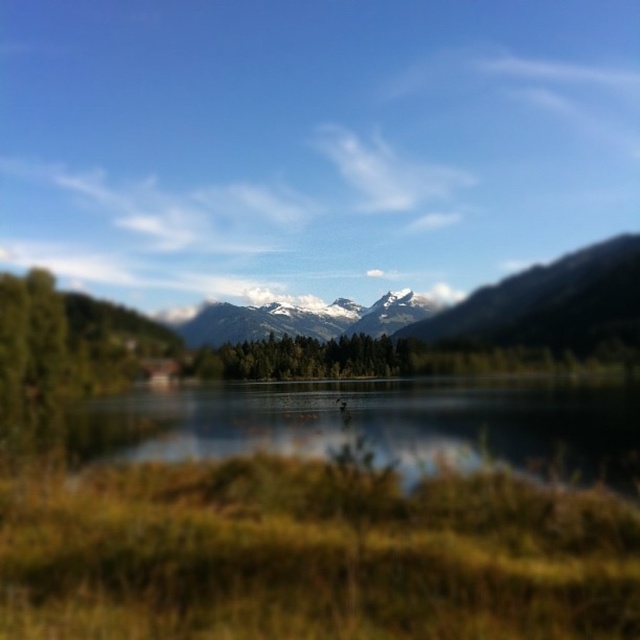
Looking at this image, you are standing on the lakeshore and looking towards the center of the image. Which object, the snowy granite mountains at center or the green matte trees at center, is positioned higher in the scene?

The snowy granite mountains at center are positioned higher in the scene than the green matte trees at center because the description states that the snowy granite mountains at center is above green matte trees at center.

You are standing on the lakeshore and want to take a photo of both the clear water at center and the snowy granite mountains at center. Which object will appear larger in the photo?

The snowy granite mountains at center will appear larger in the photo because they have a greater height than the clear water at center.